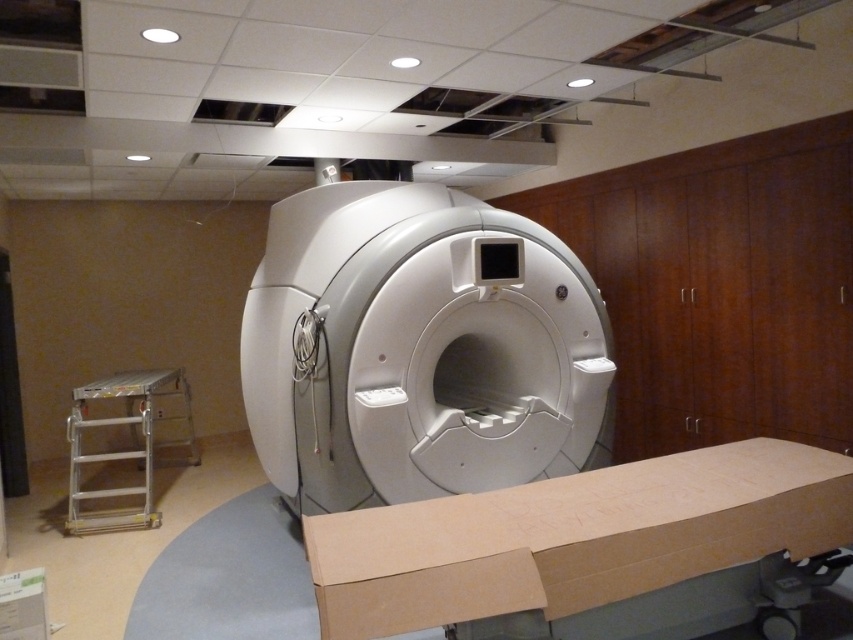
Does white plastic mri scanner at center appear under silver metallic ladder at lower left?

No, white plastic mri scanner at center is not below silver metallic ladder at lower left.

Is point (515, 300) farther from camera compared to point (68, 525)?

No.

Identify the location of white plastic mri scanner at center. (418, 348).

Is white plastic mri scanner at center behind brown cardboard box at lower center?

Yes, white plastic mri scanner at center is behind brown cardboard box at lower center.

Which is more to the right, white plastic mri scanner at center or brown cardboard box at lower center?

From the viewer's perspective, brown cardboard box at lower center appears more on the right side.

In order to click on white plastic mri scanner at center in this screenshot , I will do `click(418, 348)`.

Identify the location of white plastic mri scanner at center. (418, 348).

Is point (432, 572) in front of point (84, 397)?

That is True.

Identify the location of brown cardboard box at lower center. (575, 538).